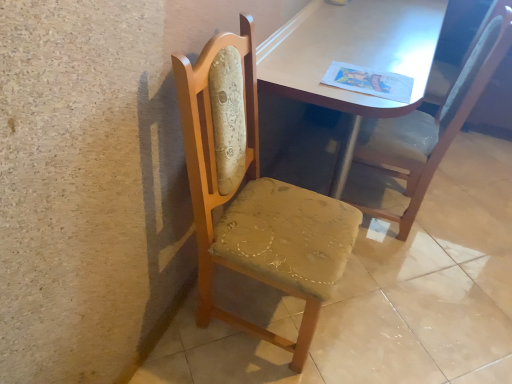
Question: Can you confirm if wooden chair at right, marked as the 2th chair in a left-to-right arrangement, is wider than wooden chair at center?

Choices:
 (A) no
 (B) yes

Answer: (A)

Question: Are wooden chair at right, marked as the 2th chair in a left-to-right arrangement, and wooden chair at center making contact?

Choices:
 (A) no
 (B) yes

Answer: (A)

Question: From the image's perspective, is wooden chair at right, marked as the 2th chair in a left-to-right arrangement, beneath wooden chair at center?

Choices:
 (A) no
 (B) yes

Answer: (A)

Question: Is wooden chair at right, the 1th chair viewed from the right, facing away from wooden chair at center?

Choices:
 (A) yes
 (B) no

Answer: (B)

Question: Is wooden chair at right, the 1th chair viewed from the right, at the left side of wooden chair at center?

Choices:
 (A) yes
 (B) no

Answer: (A)

Question: Is point (437, 296) positioned closer to the camera than point (356, 203)?

Choices:
 (A) closer
 (B) farther

Answer: (A)

Question: Considering the positions of wooden chair at center and wooden chair at right, marked as the 2th chair in a left-to-right arrangement, in the image, is wooden chair at center wider or thinner than wooden chair at right, marked as the 2th chair in a left-to-right arrangement,?

Choices:
 (A) thin
 (B) wide

Answer: (B)

Question: In terms of size, does wooden chair at center appear bigger or smaller than wooden chair at right, the 1th chair viewed from the right?

Choices:
 (A) small
 (B) big

Answer: (B)

Question: Would you say wooden chair at center is to the left or to the right of wooden chair at right, marked as the 2th chair in a left-to-right arrangement, in the picture?

Choices:
 (A) right
 (B) left

Answer: (A)

Question: From the image's perspective, is wooden chair at center located above or below woodenchair at left, the 2th chair in the right-to-left sequence?

Choices:
 (A) above
 (B) below

Answer: (B)

Question: Is wooden chair at center taller or shorter than woodenchair at left, the 2th chair in the right-to-left sequence?

Choices:
 (A) short
 (B) tall

Answer: (A)

Question: Visually, is wooden chair at center positioned to the left or to the right of woodenchair at left, the 1th chair in the left-to-right sequence?

Choices:
 (A) left
 (B) right

Answer: (B)

Question: Relative to woodenchair at left, the 1th chair in the left-to-right sequence, is wooden chair at center in front or behind?

Choices:
 (A) front
 (B) behind

Answer: (B)

Question: From a real-world perspective, relative to matte wooden table at center, is wooden chair at center vertically above or below?

Choices:
 (A) above
 (B) below

Answer: (B)

Question: Is wooden chair at center inside or outside of matte wooden table at center?

Choices:
 (A) inside
 (B) outside

Answer: (B)